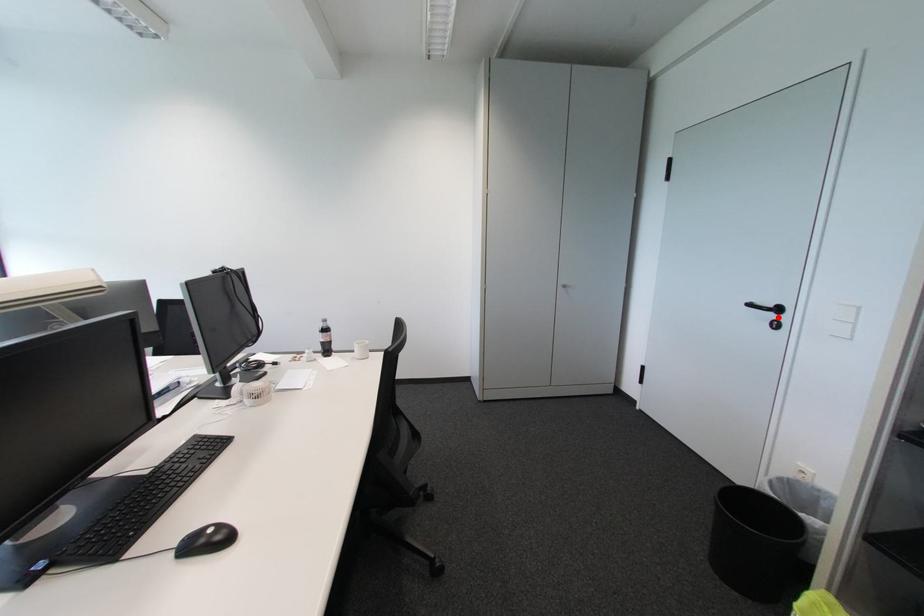
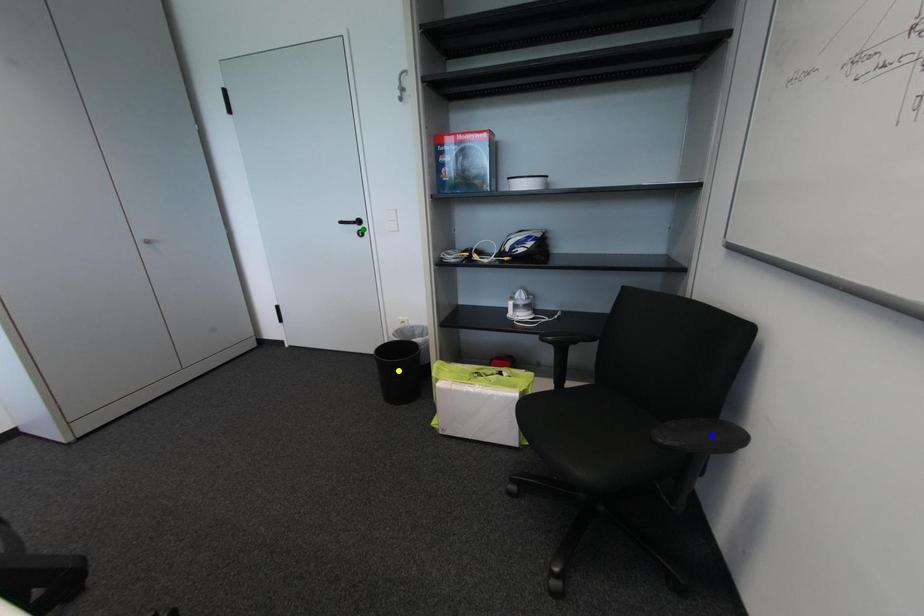
Question: I am providing you with two images of the same scene from different viewpoints. A red point is marked on the first image. You are given multiple points on the second image. In image 2, which mark is for the same physical point as the one in image 1?

Choices:
 (A) green point
 (B) blue point
 (C) yellow point

Answer: (A)